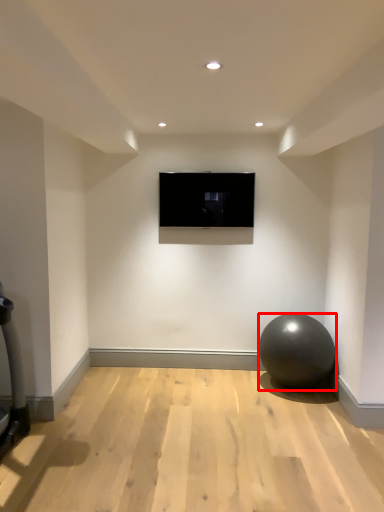
Question: In this image, where is ball (annotated by the red box) located relative to television?

Choices:
 (A) right
 (B) left

Answer: (A)